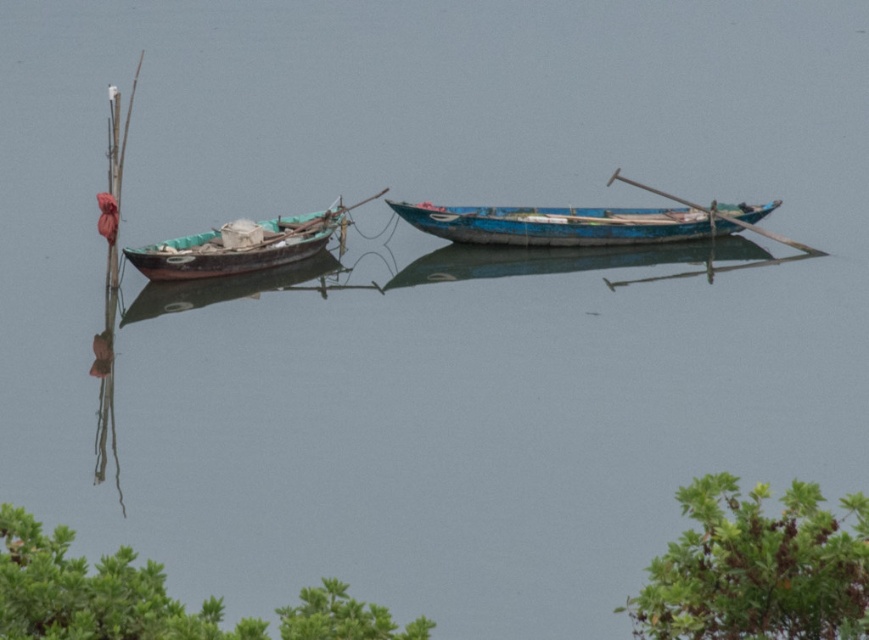
You are standing on the dock and want to board the taller boat between the blue wooden boat at center and the wooden boat at left. Which boat should you choose?

You should choose the wooden boat at left because it is taller than the blue wooden boat at center.

You are standing on a dock and want to reach the blue wooden boat at center. If your walking speed is 3 feet per second, how many seconds will it take you to reach the boat?

The blue wooden boat at center is 68.75 feet away from the viewer. At a walking speed of 3 feet per second, it will take 68.75 divided by 3, which is approximately 22.92 seconds. So, it will take about 23 seconds to reach the boat.

You are standing on the dock and want to tie your boat to the green leafy tree at lower right. However, there is a wooden boat at left in the way. Can you reach the tree without moving the boat?

The green leafy tree at lower right is positioned under the wooden boat at left, so you cannot reach the tree without moving the wooden boat at left.